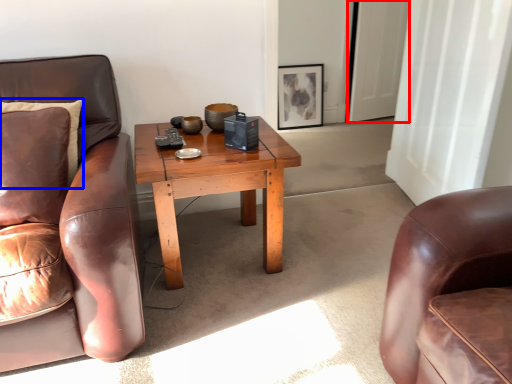
Question: Which of the following is the closest to the observer, glass door (highlighted by a red box) or pillow (highlighted by a blue box)?

Choices:
 (A) glass door
 (B) pillow

Answer: (B)